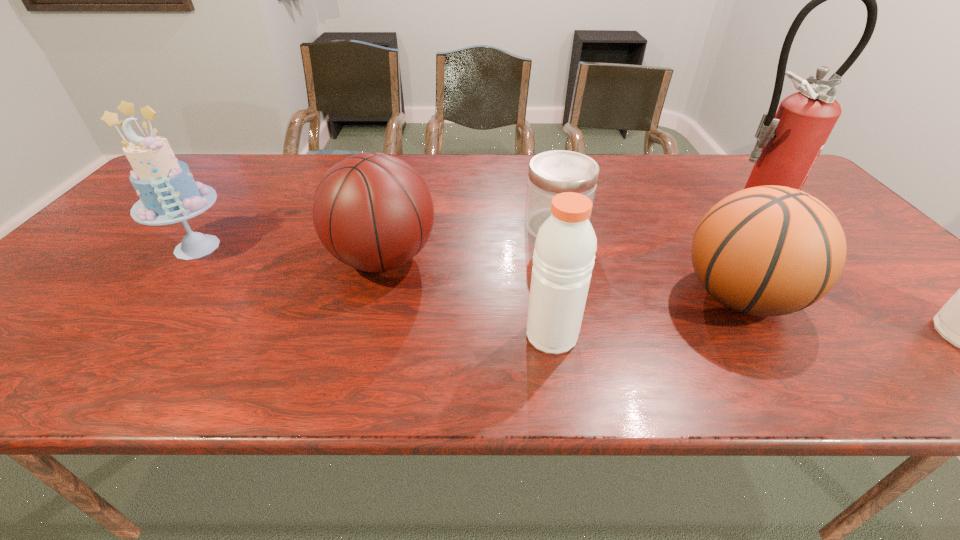
Locate an element on the screen. The height and width of the screenshot is (540, 960). free region at the near left corner of the desktop is located at coordinates (48, 322).

In order to click on free space that is in between the cake and the fire extinguisher in this screenshot , I will do `click(473, 227)`.

Where is `vacant region between the left basketball and the fourth shortest object`? Image resolution: width=960 pixels, height=540 pixels. vacant region between the left basketball and the fourth shortest object is located at coordinates 468,297.

At what (x,y) coordinates should I click in order to perform the action: click on free spot between the cake and the second object from left to right. Please return your answer as a coordinate pair (x, y). Image resolution: width=960 pixels, height=540 pixels. Looking at the image, I should click on (290, 253).

I want to click on free space between the shaker and the leftmost object, so click(374, 291).

I want to click on object that stands as the second closest to the leftmost object, so click(x=565, y=246).

Locate which object is the fifth closest to the left basketball. Please provide its 2D coordinates. Your answer should be formatted as a tuple, i.e. [(x, y)], where the tuple contains the x and y coordinates of a point satisfying the conditions above.

[(789, 142)]